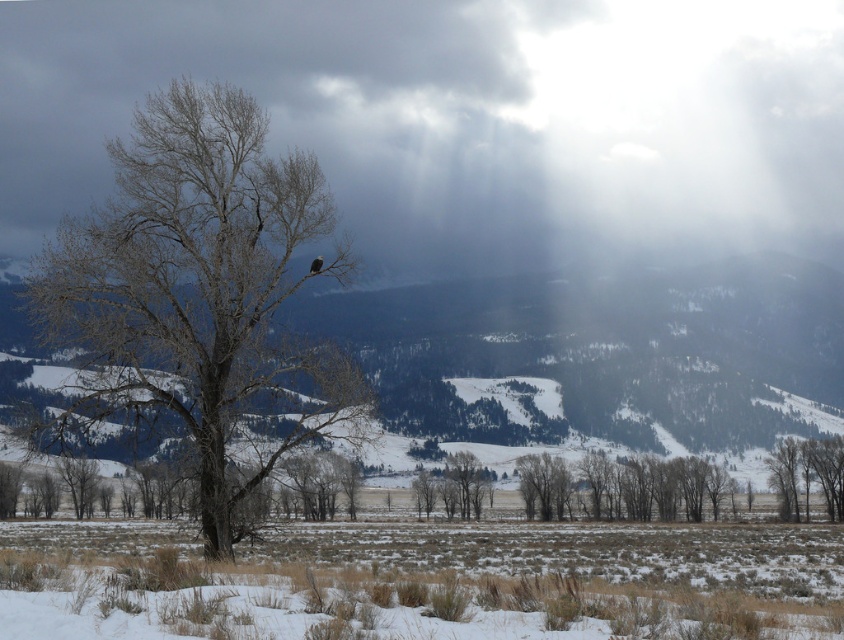
Can you confirm if gray bark tree at center is shorter than smooth brown tree at lower right?

No.

What do you see at coordinates (201, 296) in the screenshot? The image size is (844, 640). I see `gray bark tree at center` at bounding box center [201, 296].

Image resolution: width=844 pixels, height=640 pixels. Identify the location of gray bark tree at center. (201, 296).

Who is shorter, cloudy gray sky at upper center or smooth bark tree at center?

Standing shorter between the two is smooth bark tree at center.

Can you confirm if cloudy gray sky at upper center is bigger than smooth bark tree at center?

Yes, cloudy gray sky at upper center is bigger than smooth bark tree at center.

The width and height of the screenshot is (844, 640). Identify the location of cloudy gray sky at upper center. (464, 120).

Which is behind, point (456, 502) or point (533, 456)?

Positioned behind is point (533, 456).

From the picture: Can you confirm if smooth brown tree at center is taller than smooth bark tree at center?

No.

Is point (431, 480) closer to camera compared to point (534, 484)?

No, it is behind (534, 484).

Image resolution: width=844 pixels, height=640 pixels. I want to click on smooth brown tree at center, so click(x=453, y=486).